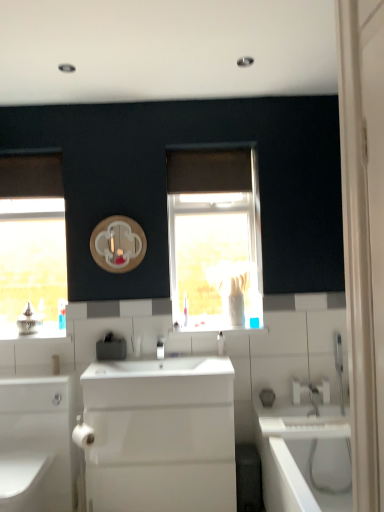
Locate an element on the screen. The image size is (384, 512). free space to the left of white glossy soap dispenser at center is located at coordinates [x=198, y=356].